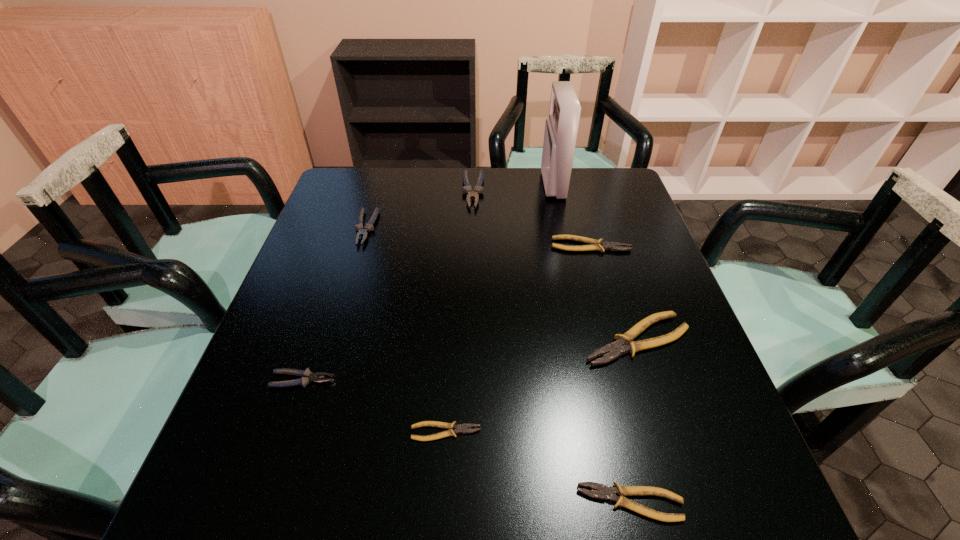
Find the location of a particular element. This screenshot has height=540, width=960. the first-aid kit is located at coordinates (561, 128).

Find the location of a particular element. This screenshot has width=960, height=540. the tallest object is located at coordinates (561, 128).

Image resolution: width=960 pixels, height=540 pixels. In order to click on the biggest gray pliers in this screenshot , I will do `click(466, 189)`.

I want to click on the tallest pliers, so click(x=466, y=189).

In order to click on the second smallest gray pliers in this screenshot , I will do `click(362, 231)`.

Locate an element on the screen. the third nearest yellow pliers is located at coordinates (613, 350).

Locate an element on the screen. the biggest yellow pliers is located at coordinates (613, 350).

At what (x,y) coordinates should I click in order to perform the action: click on the third smallest yellow pliers. Please return your answer as a coordinate pair (x, y). This screenshot has height=540, width=960. Looking at the image, I should click on (598, 245).

You are a GUI agent. You are given a task and a screenshot of the screen. Output one action in this format:
    pyautogui.click(x=<x>, y=<y>)
    Task: Click on the third nearest pliers
    
    Given the screenshot: What is the action you would take?
    pyautogui.click(x=307, y=376)

Image resolution: width=960 pixels, height=540 pixels. In order to click on the sixth farthest object in this screenshot , I will do `click(307, 376)`.